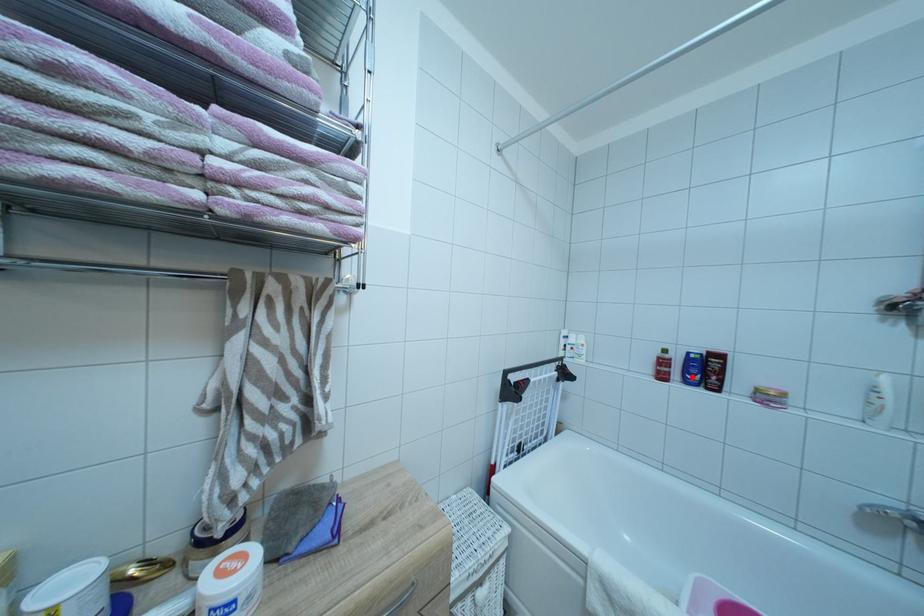
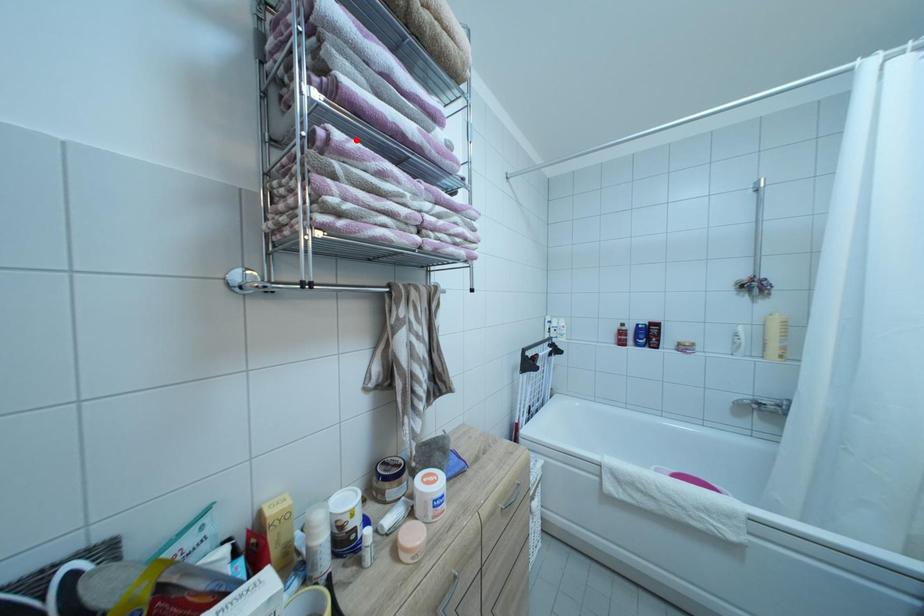
I am providing you with two images of the same scene from different viewpoints. A red point is marked on the first image and another point is marked on the second image. Do the highlighted points in image1 and image2 indicate the same real-world spot?

No